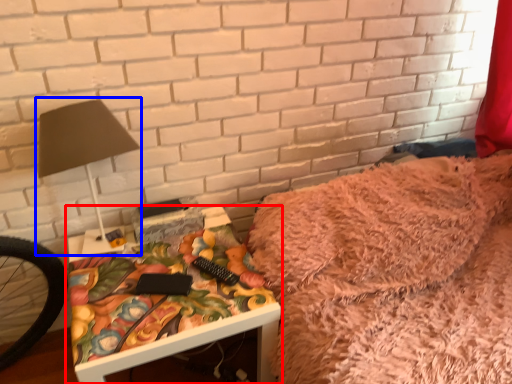
Question: Among these objects, which one is nearest to the camera, table (highlighted by a red box) or table lamp (highlighted by a blue box)?

Choices:
 (A) table
 (B) table lamp

Answer: (B)